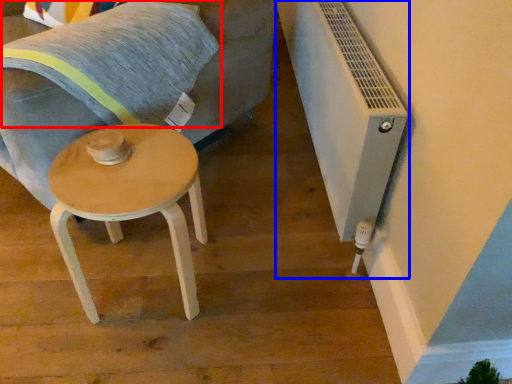
Question: Which object is further to the camera taking this photo, pillow (highlighted by a red box) or air conditioning (highlighted by a blue box)?

Choices:
 (A) pillow
 (B) air conditioning

Answer: (A)